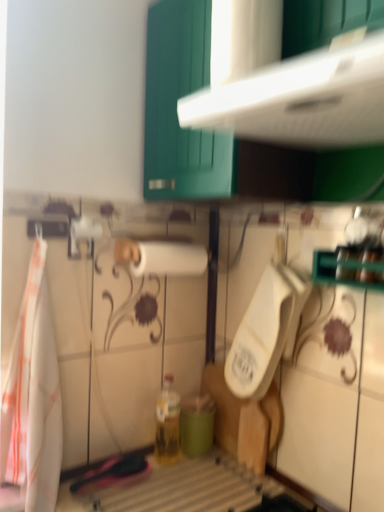
Question: Is white matte paper towel at center directly adjacent to teal matte cup at lower center?

Choices:
 (A) no
 (B) yes

Answer: (A)

Question: Can you confirm if white matte paper towel at center is positioned to the right of teal matte cup at lower center?

Choices:
 (A) no
 (B) yes

Answer: (A)

Question: Would you consider white matte paper towel at center to be distant from teal matte cup at lower center?

Choices:
 (A) yes
 (B) no

Answer: (B)

Question: Is white matte paper towel at center in front of teal matte cup at lower center?

Choices:
 (A) no
 (B) yes

Answer: (B)

Question: Is white matte paper towel at center to the left of teal matte cup at lower center from the viewer's perspective?

Choices:
 (A) no
 (B) yes

Answer: (B)

Question: In the image, is teal matte cup at lower center positioned in front of or behind white fabric towel at left?

Choices:
 (A) behind
 (B) front

Answer: (A)

Question: Does point (195, 434) appear closer or farther from the camera than point (49, 322)?

Choices:
 (A) closer
 (B) farther

Answer: (B)

Question: Would you say teal matte cup at lower center is to the left or to the right of white fabric towel at left in the picture?

Choices:
 (A) right
 (B) left

Answer: (A)

Question: From the image's perspective, is teal matte cup at lower center above or below white fabric towel at left?

Choices:
 (A) above
 (B) below

Answer: (B)

Question: Looking at their shapes, would you say white matte paper towel at center is wider or thinner than translucent glass bottle at center?

Choices:
 (A) thin
 (B) wide

Answer: (B)

Question: Choose the correct answer: Is white matte paper towel at center inside translucent glass bottle at center or outside it?

Choices:
 (A) inside
 (B) outside

Answer: (B)

Question: Based on their sizes in the image, would you say white matte paper towel at center is bigger or smaller than translucent glass bottle at center?

Choices:
 (A) small
 (B) big

Answer: (B)

Question: In terms of height, does white matte paper towel at center look taller or shorter compared to translucent glass bottle at center?

Choices:
 (A) tall
 (B) short

Answer: (B)

Question: Based on their positions, is teal matte cup at lower center located to the left or right of translucent glass bottle at center?

Choices:
 (A) right
 (B) left

Answer: (A)

Question: From a real-world perspective, is teal matte cup at lower center positioned above or below translucent glass bottle at center?

Choices:
 (A) below
 (B) above

Answer: (A)